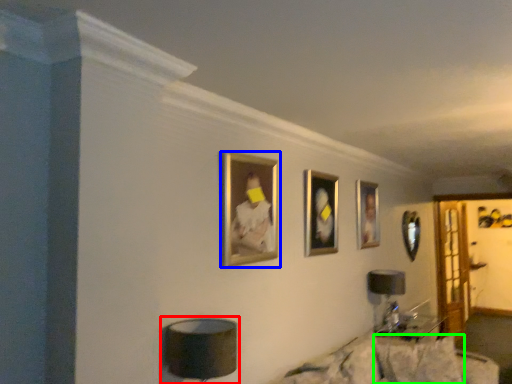
Question: Estimate the real-world distances between objects in this image. Which object is farther from table lamp (highlighted by a red box), picture frame (highlighted by a blue box) or pillow (highlighted by a green box)?

Choices:
 (A) picture frame
 (B) pillow

Answer: (B)